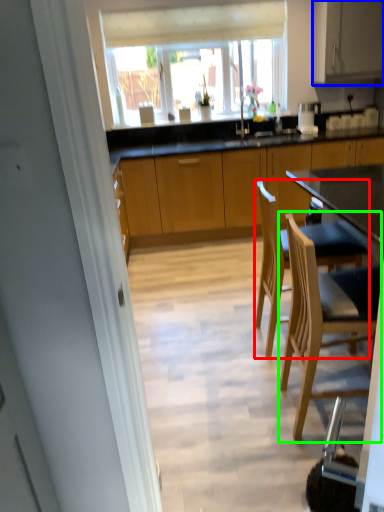
Question: Estimate the real-world distances between objects in this image. Which object is farther from chair (highlighted by a red box), cabinetry (highlighted by a blue box) or chair (highlighted by a green box)?

Choices:
 (A) cabinetry
 (B) chair

Answer: (A)